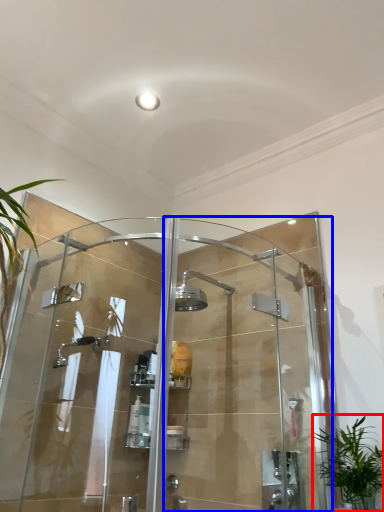
Question: Among these objects, which one is nearest to the camera, houseplant (highlighted by a red box) or screen door (highlighted by a blue box)?

Choices:
 (A) houseplant
 (B) screen door

Answer: (B)